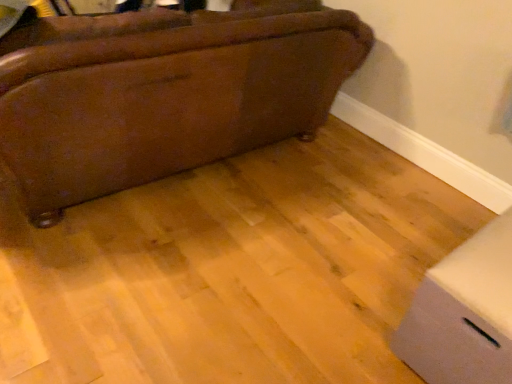
Question: Considering the positions of white cardboard box at lower right and brown leather couch at upper left in the image, is white cardboard box at lower right taller or shorter than brown leather couch at upper left?

Choices:
 (A) short
 (B) tall

Answer: (A)

Question: From the image's perspective, is white cardboard box at lower right above or below brown leather couch at upper left?

Choices:
 (A) above
 (B) below

Answer: (B)

Question: Would you say white cardboard box at lower right is to the left or to the right of brown leather couch at upper left in the picture?

Choices:
 (A) right
 (B) left

Answer: (A)

Question: From a real-world perspective, relative to white cardboard box at lower right, is brown leather couch at upper left vertically above or below?

Choices:
 (A) above
 (B) below

Answer: (A)

Question: Is brown leather couch at upper left inside the boundaries of white cardboard box at lower right, or outside?

Choices:
 (A) outside
 (B) inside

Answer: (A)

Question: Looking at their shapes, would you say brown leather couch at upper left is wider or thinner than white cardboard box at lower right?

Choices:
 (A) wide
 (B) thin

Answer: (A)

Question: Relative to white cardboard box at lower right, is brown leather couch at upper left in front or behind?

Choices:
 (A) behind
 (B) front

Answer: (A)